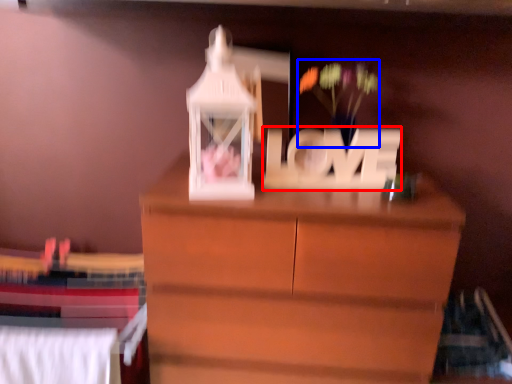
Question: Among these objects, which one is nearest to the camera, letter (highlighted by a red box) or floral arrangement (highlighted by a blue box)?

Choices:
 (A) letter
 (B) floral arrangement

Answer: (A)